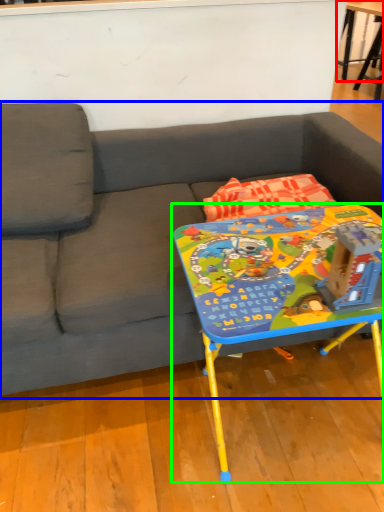
Question: Which object is positioned farthest from table (highlighted by a red box)? Select from studio couch (highlighted by a blue box) and table (highlighted by a green box).

Choices:
 (A) studio couch
 (B) table

Answer: (B)